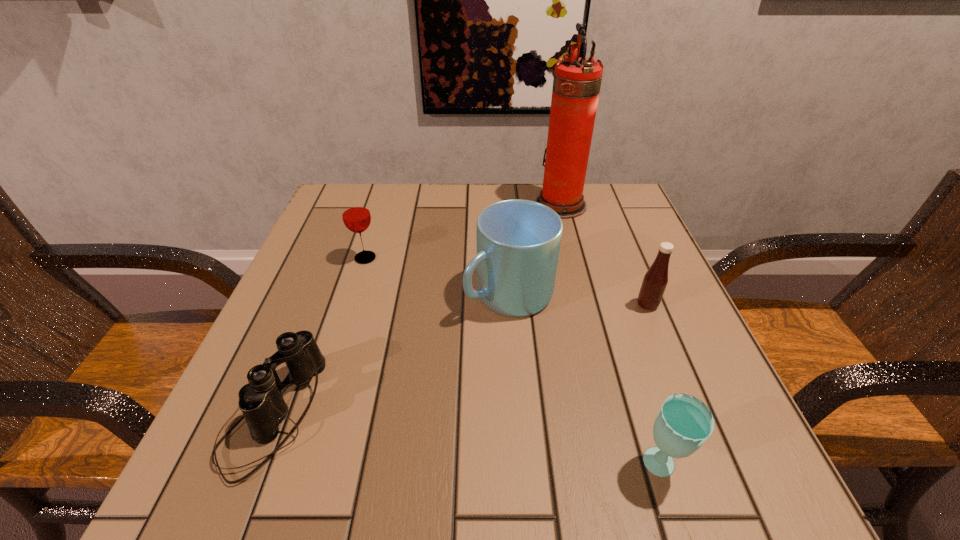
In the image, there is a desktop. Identify the location of free space at the near left corner. (308, 485).

The image size is (960, 540). In the image, there is a desktop. Identify the location of vacant area at the far right corner. (649, 236).

At what (x,y) coordinates should I click in order to perform the action: click on free spot between the farther glass and the right glass. Please return your answer as a coordinate pair (x, y). This screenshot has height=540, width=960. Looking at the image, I should click on (513, 362).

Locate an element on the screen. This screenshot has height=540, width=960. empty location between the shortest object and the tallest object is located at coordinates (417, 310).

Image resolution: width=960 pixels, height=540 pixels. I want to click on free space between the nearer glass and the binoculars, so click(x=467, y=441).

This screenshot has height=540, width=960. Find the location of `free spot between the Tabasco sauce and the farthest object`. free spot between the Tabasco sauce and the farthest object is located at coordinates pyautogui.click(x=604, y=255).

Find the location of `vacant space that is in between the nearer glass and the mug`. vacant space that is in between the nearer glass and the mug is located at coordinates (585, 381).

The image size is (960, 540). I want to click on free space between the farthest object and the farther glass, so click(x=463, y=231).

Find the location of a particular element. The width and height of the screenshot is (960, 540). free spot between the shortest object and the farther glass is located at coordinates (319, 336).

Choose which object is the fifth nearest neighbor to the rightmost object. Please provide its 2D coordinates. Your answer should be formatted as a tuple, i.e. [(x, y)], where the tuple contains the x and y coordinates of a point satisfying the conditions above.

[(261, 402)]